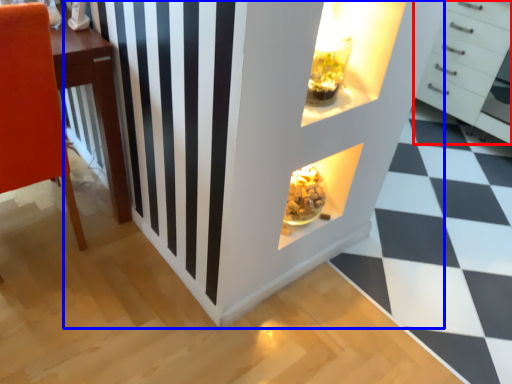
Question: Which point is closer to the camera, chest of drawers (highlighted by a red box) or dresser (highlighted by a blue box)?

Choices:
 (A) chest of drawers
 (B) dresser

Answer: (B)